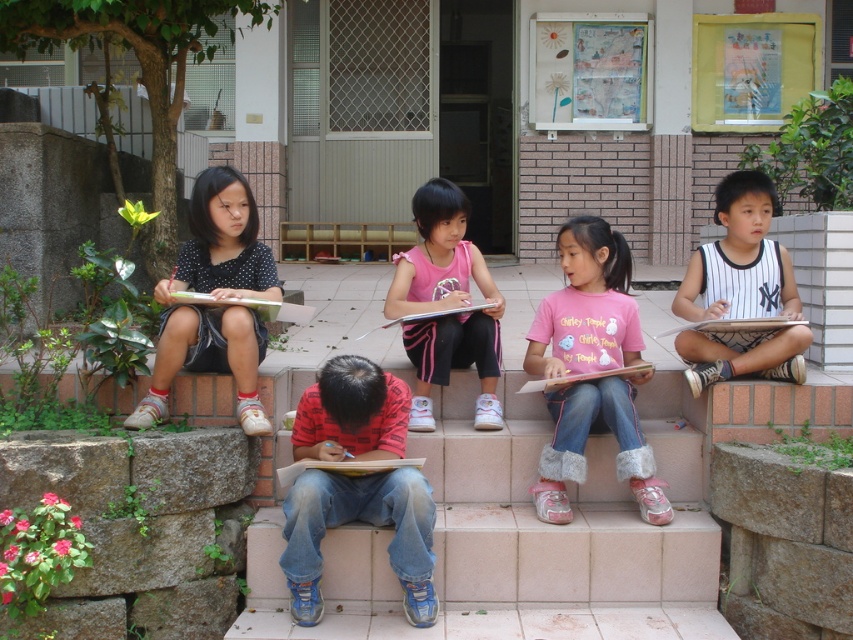
You are a photographer trying to capture a photo of the children on the steps. You notice the red printed shirt at center and the white striped jersey at right. Which child should you focus on first if you want to ensure both are in the frame without moving the camera?

You should focus on the red printed shirt at center first because it is positioned under the white striped jersey at right, meaning it is closer to the camera. By focusing on the closer subject, both will be in focus if they are within the camera focus range.

You are a photographer trying to capture a closeup of the pink cotton shirt at center and the matte pink book at center. Which object should you zoom in on to ensure it fits entirely within the frame without cropping?

The matte pink book at center has a smaller width than the pink cotton shirt at center, so zooming in on the matte pink book at center would ensure it fits entirely within the frame without cropping.

You are a photographer standing in front of the outdoor steps where the children are sitting. You want to take a photo that includes both the pink fabric shirt at center and the matte paper book at center. Which object should you focus on first to ensure both are in clear view?

You should focus on the pink fabric shirt at center first because it is closer to you than the matte paper book at center, ensuring both will be in focus when you adjust the camera accordingly.